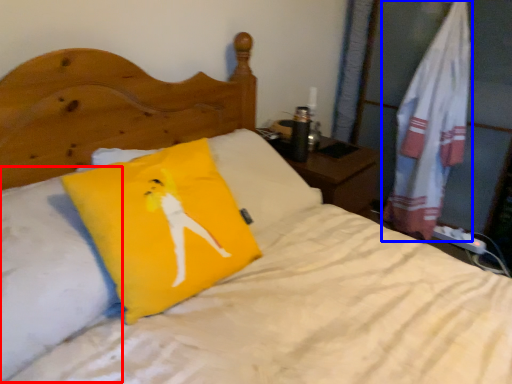
Question: Which point is closer to the camera, pillow (highlighted by a red box) or material (highlighted by a blue box)?

Choices:
 (A) pillow
 (B) material

Answer: (A)